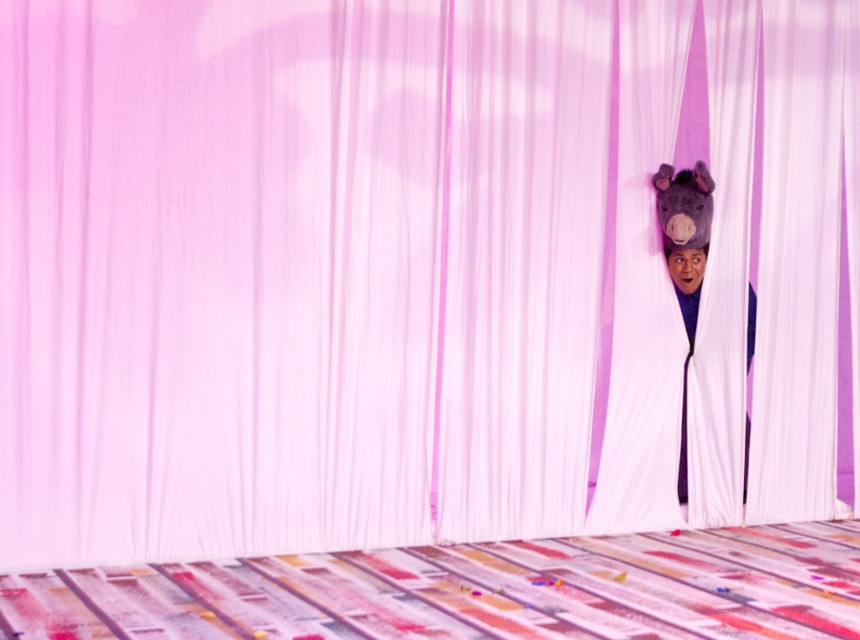
Does point (652, 536) come behind point (697, 285)?

No.

Which is behind, point (10, 627) or point (692, 304)?

The point (692, 304) is behind.

This screenshot has height=640, width=860. What do you see at coordinates (470, 592) in the screenshot?
I see `multicolored fabric bed at center` at bounding box center [470, 592].

Identify the location of multicolored fabric bed at center. (470, 592).